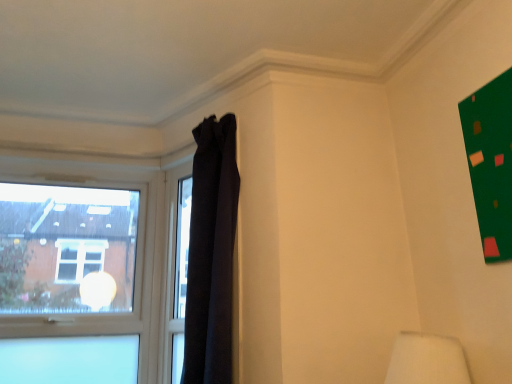
Question: Is black fabric curtain at upper center placed right next to transparent glass window at left?

Choices:
 (A) yes
 (B) no

Answer: (B)

Question: Does black fabric curtain at upper center turn towards transparent glass window at left?

Choices:
 (A) no
 (B) yes

Answer: (A)

Question: Is black fabric curtain at upper center positioned beyond the bounds of transparent glass window at left?

Choices:
 (A) no
 (B) yes

Answer: (B)

Question: Is black fabric curtain at upper center bigger than transparent glass window at left?

Choices:
 (A) yes
 (B) no

Answer: (A)

Question: Is black fabric curtain at upper center in front of transparent glass window at left?

Choices:
 (A) no
 (B) yes

Answer: (B)

Question: Does black fabric curtain at upper center appear on the right side of transparent glass window at left?

Choices:
 (A) yes
 (B) no

Answer: (A)

Question: From a real-world perspective, is transparent glass window at left positioned over black fabric curtain at upper center based on gravity?

Choices:
 (A) yes
 (B) no

Answer: (B)

Question: From the image's perspective, does transparent glass window at left appear lower than black fabric curtain at upper center?

Choices:
 (A) yes
 (B) no

Answer: (A)

Question: Can you confirm if transparent glass window at left is smaller than black fabric curtain at upper center?

Choices:
 (A) no
 (B) yes

Answer: (B)

Question: Is black fabric curtain at upper center a part of transparent glass window at left?

Choices:
 (A) yes
 (B) no

Answer: (B)

Question: From the image's perspective, is transparent glass window at left on top of black fabric curtain at upper center?

Choices:
 (A) no
 (B) yes

Answer: (A)

Question: From a real-world perspective, does transparent glass window at left sit lower than black fabric curtain at upper center?

Choices:
 (A) no
 (B) yes

Answer: (B)

Question: In terms of width, does black fabric curtain at upper center look wider or thinner when compared to transparent glass window at left?

Choices:
 (A) wide
 (B) thin

Answer: (A)